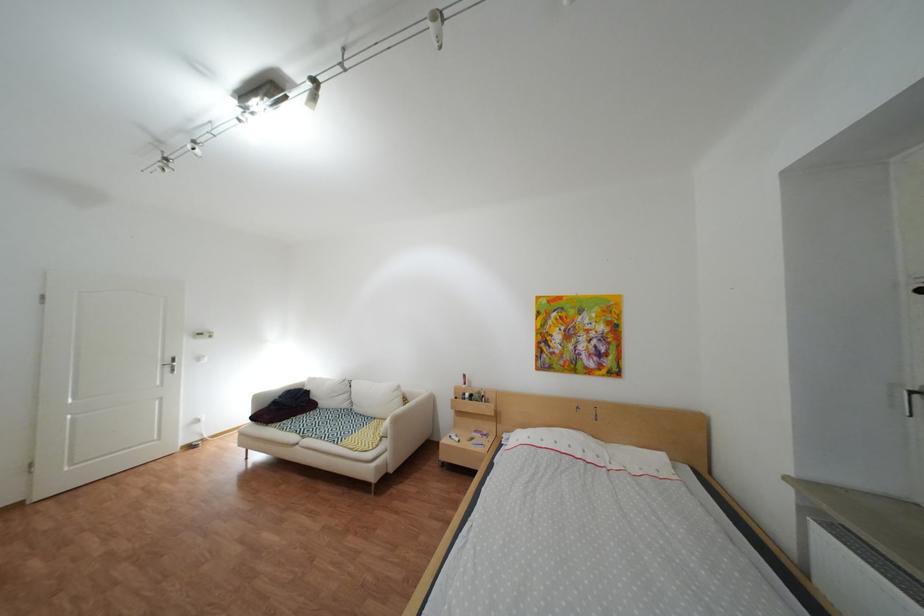
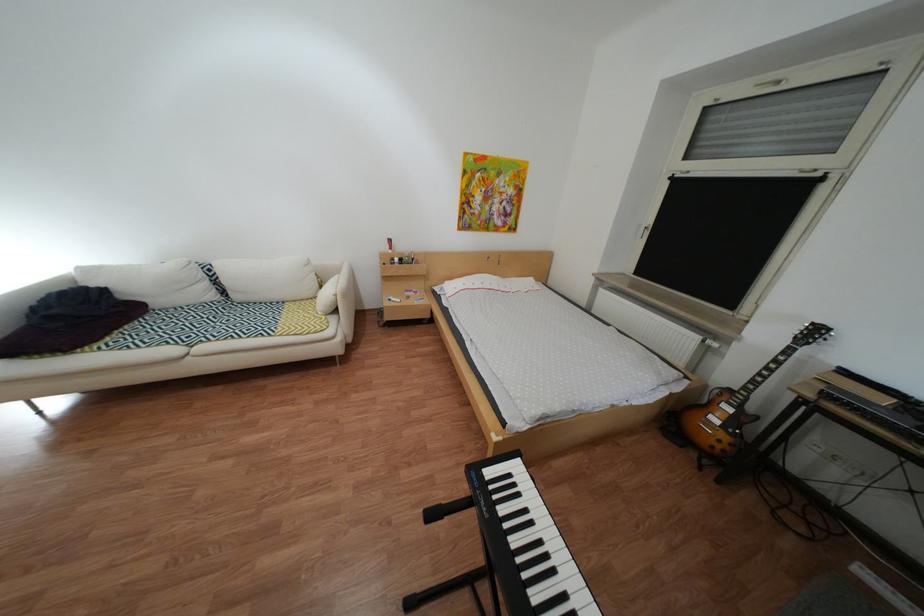
Find the pixel in the second image that matches (x=337, y=405) in the first image.

(172, 304)